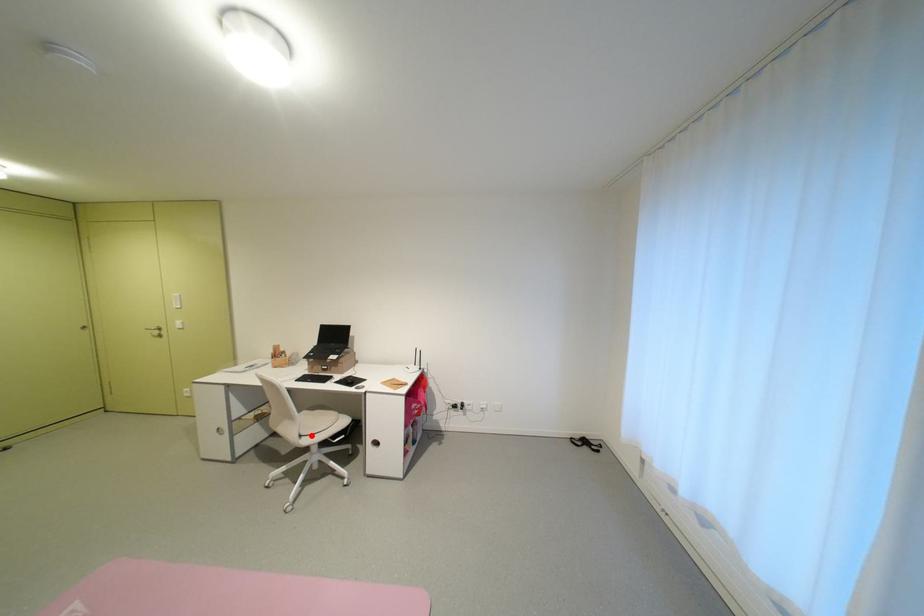
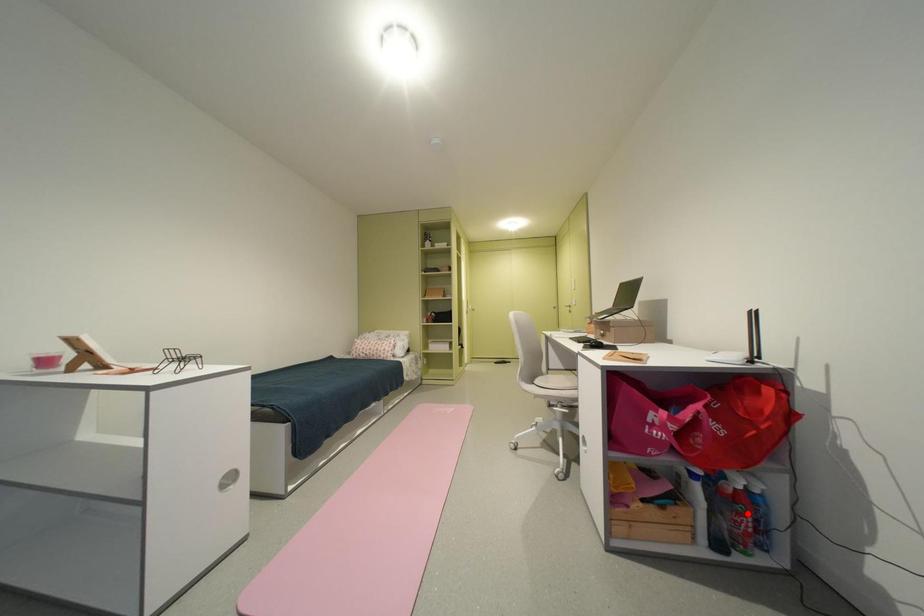
I am providing you with two images of the same scene from different viewpoints. A red point is marked on the first image and another point is marked on the second image. Do the highlighted points in image1 and image2 indicate the same real-world spot?

No